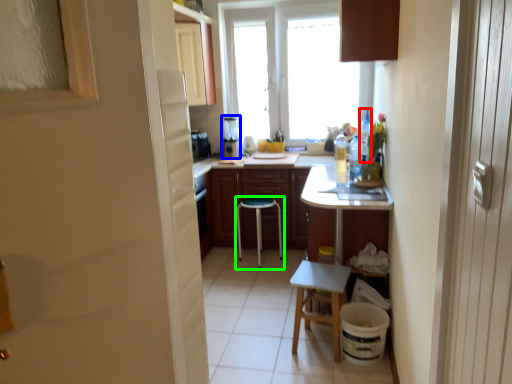
Question: Which object is positioned farthest from bottle (highlighted by a red box)? Select from appliance (highlighted by a blue box) and stool (highlighted by a green box).

Choices:
 (A) appliance
 (B) stool

Answer: (A)